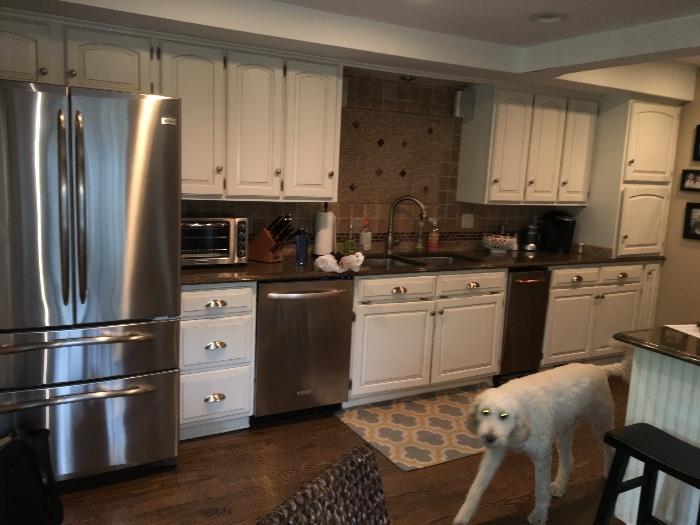
Locate an element on the screen. faucet arc is located at coordinates (407, 199).